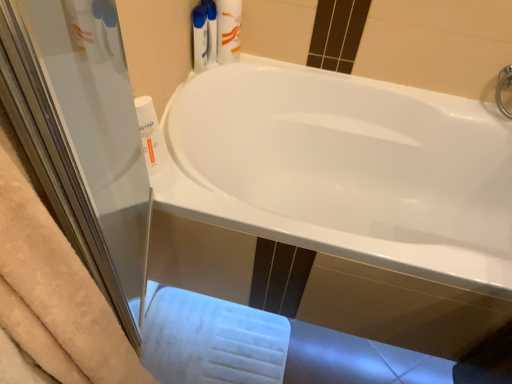
Measure the distance between white plastic bottle at left, the 2th cleaning product positioned from the right, and camera.

They are 36.10 inches apart.

Measure the distance between point (233, 0) and camera.

Point (233, 0) is 1.26 meters away from camera.

Describe the element at coordinates (228, 30) in the screenshot. This screenshot has height=384, width=512. I see `white plastic tube at upper center` at that location.

Identify the location of white glossy bathtub at center. The width and height of the screenshot is (512, 384). (344, 169).

Find the location of `white plastic bottle at upper center, which is counted as the second cleaning product, starting from the bottom`. white plastic bottle at upper center, which is counted as the second cleaning product, starting from the bottom is located at coordinates (204, 35).

Is white glossy bathtub at center not close to white plastic bottle at upper center, the 2th cleaning product positioned from the front?

white glossy bathtub at center is near white plastic bottle at upper center, the 2th cleaning product positioned from the front, not far away.

Is white glossy bathtub at center bigger than white plastic bottle at upper center, the second cleaning product positioned from the left?

Yes, white glossy bathtub at center is bigger than white plastic bottle at upper center, the second cleaning product positioned from the left.

From the picture: Can you confirm if white glossy bathtub at center is positioned to the left of white plastic bottle at upper center, the 1th cleaning product viewed from the top?

Incorrect, white glossy bathtub at center is not on the left side of white plastic bottle at upper center, the 1th cleaning product viewed from the top.

Consider the image. Is white glossy bathtub at center taller or shorter than white plastic bottle at upper center, the 1th cleaning product viewed from the top?

In the image, white glossy bathtub at center appears to be taller than white plastic bottle at upper center, the 1th cleaning product viewed from the top.

From the image's perspective, is white glossy bathtub at center located above white plastic tube at upper center?

No, from the image's perspective, white glossy bathtub at center is not on top of white plastic tube at upper center.

Is white glossy bathtub at center facing towards white plastic tube at upper center?

No, white glossy bathtub at center is not facing towards white plastic tube at upper center.

Considering the positions of objects white glossy bathtub at center and white plastic tube at upper center in the image provided, who is more to the left, white glossy bathtub at center or white plastic tube at upper center?

white plastic tube at upper center is more to the left.

From a real-world perspective, is white glossy bathtub at center over white plastic tube at upper center?

Actually, white glossy bathtub at center is physically below white plastic tube at upper center in the real world.

Considering the positions of objects white plastic tube at upper center and white plastic bottle at left, which is the first cleaning product from left to right, in the image provided, who is more to the left, white plastic tube at upper center or white plastic bottle at left, which is the first cleaning product from left to right,?

From the viewer's perspective, white plastic bottle at left, which is the first cleaning product from left to right, appears more on the left side.

From the image's perspective, is white plastic tube at upper center below white plastic bottle at left, which is the first cleaning product from left to right?

No, from the image's perspective, white plastic tube at upper center is not below white plastic bottle at left, which is the first cleaning product from left to right.

Considering the relative sizes of white plastic tube at upper center and white plastic bottle at left, which is counted as the second cleaning product, starting from the top, in the image provided, is white plastic tube at upper center thinner than white plastic bottle at left, which is counted as the second cleaning product, starting from the top,?

In fact, white plastic tube at upper center might be wider than white plastic bottle at left, which is counted as the second cleaning product, starting from the top.

Is white plastic tube at upper center turned away from white plastic bottle at upper center, which is counted as the first cleaning product, starting from the back?

Yes, white plastic tube at upper center is facing away from white plastic bottle at upper center, which is counted as the first cleaning product, starting from the back.

How far apart are white plastic tube at upper center and white plastic bottle at upper center, the 1th cleaning product viewed from the top?

white plastic tube at upper center and white plastic bottle at upper center, the 1th cleaning product viewed from the top, are 1.67 inches apart from each other.

Is white plastic tube at upper center smaller than white plastic bottle at upper center, which is counted as the first cleaning product, starting from the back?

No, white plastic tube at upper center is not smaller than white plastic bottle at upper center, which is counted as the first cleaning product, starting from the back.

This screenshot has height=384, width=512. What are the coordinates of `toiletry on the right of white plastic bottle at upper center, which is counted as the first cleaning product, starting from the back` in the screenshot? It's located at (228, 30).

From a real-world perspective, does white plastic bottle at left, which is the first cleaning product from left to right, sit lower than white glossy bathtub at center?

Incorrect, from a real-world perspective, white plastic bottle at left, which is the first cleaning product from left to right, is higher than white glossy bathtub at center.

The width and height of the screenshot is (512, 384). What are the coordinates of `the 1st cleaning product behind the white glossy bathtub at center` in the screenshot? It's located at (149, 134).

Who is taller, white plastic bottle at left, positioned as the first cleaning product in front-to-back order, or white glossy bathtub at center?

Standing taller between the two is white glossy bathtub at center.

From the image's perspective, which one is positioned lower, white plastic bottle at upper center, which is counted as the second cleaning product, starting from the bottom, or white plastic tube at upper center?

From the image's view, white plastic bottle at upper center, which is counted as the second cleaning product, starting from the bottom, is below.

Would you say white plastic bottle at upper center, the 1th cleaning product viewed from the top, contains white plastic tube at upper center?

No.

Based on the photo, which is more to the right, white plastic bottle at upper center, the 2th cleaning product positioned from the front, or white plastic tube at upper center?

From the viewer's perspective, white plastic tube at upper center appears more on the right side.

At what (x,y) coordinates should I click in order to perform the action: click on the 1st cleaning product located beneath the white plastic tube at upper center (from a real-world perspective). Please return your answer as a coordinate pair (x, y). Image resolution: width=512 pixels, height=384 pixels. Looking at the image, I should click on (204, 35).

Is white plastic bottle at left, which is the first cleaning product from left to right, aimed at white plastic tube at upper center?

No, white plastic bottle at left, which is the first cleaning product from left to right, is not facing towards white plastic tube at upper center.

Which of these two, white plastic bottle at left, which is counted as the second cleaning product, starting from the top, or white plastic tube at upper center, stands shorter?

white plastic bottle at left, which is counted as the second cleaning product, starting from the top.

In order to click on toiletry behind the white plastic bottle at left, the 2th cleaning product positioned from the right in this screenshot , I will do `click(228, 30)`.

From the image's perspective, which is above, white plastic bottle at left, the first cleaning product from the bottom, or white plastic tube at upper center?

From the image's view, white plastic tube at upper center is above.

Locate an element on the screen. bathtub on the right of white plastic bottle at upper center, the 1th cleaning product viewed from the top is located at coordinates (344, 169).

Locate an element on the screen. The height and width of the screenshot is (384, 512). bathtub that is in front of the white plastic tube at upper center is located at coordinates (344, 169).

Estimate the real-world distances between objects in this image. Which object is further from white plastic bottle at left, the 2th cleaning product when ordered from back to front, white glossy bathtub at center or white plastic tube at upper center?

The object further to white plastic bottle at left, the 2th cleaning product when ordered from back to front, is white glossy bathtub at center.

Based on their spatial positions, is white plastic bottle at left, which is counted as the second cleaning product, starting from the top, or white glossy bathtub at center closer to white plastic tube at upper center?

white plastic bottle at left, which is counted as the second cleaning product, starting from the top.

When comparing their distances from white plastic tube at upper center, does white glossy bathtub at center or white plastic bottle at upper center, which is counted as the first cleaning product, starting from the back, seem further?

Among the two, white glossy bathtub at center is located further to white plastic tube at upper center.

Consider the image. Considering their positions, is white plastic bottle at upper center, the 1th cleaning product viewed from the top, positioned further to white glossy bathtub at center than white plastic tube at upper center?

The object further to white glossy bathtub at center is white plastic bottle at upper center, the 1th cleaning product viewed from the top.

Looking at the image, which one is located closer to white plastic tube at upper center, white plastic bottle at upper center, the 1th cleaning product viewed from the top, or white plastic bottle at left, the 2th cleaning product positioned from the right?

white plastic bottle at upper center, the 1th cleaning product viewed from the top, is closer to white plastic tube at upper center.

Consider the image. When comparing their distances from white plastic bottle at upper center, which is counted as the second cleaning product, starting from the bottom, does white glossy bathtub at center or white plastic tube at upper center seem further?

Based on the image, white glossy bathtub at center appears to be further to white plastic bottle at upper center, which is counted as the second cleaning product, starting from the bottom.

From the picture: Looking at the image, which one is located further to white plastic bottle at left, the first cleaning product from the bottom, white plastic bottle at upper center, the second cleaning product positioned from the left, or white glossy bathtub at center?

white glossy bathtub at center is further to white plastic bottle at left, the first cleaning product from the bottom.

Looking at this image, looking at the image, which one is located closer to white plastic bottle at left, the 2th cleaning product when ordered from back to front, white plastic tube at upper center or white plastic bottle at upper center, the 1th cleaning product viewed from the top?

white plastic bottle at upper center, the 1th cleaning product viewed from the top.

This screenshot has width=512, height=384. I want to click on toiletry between white plastic bottle at left, which is counted as the second cleaning product, starting from the top, and white glossy bathtub at center from left to right, so click(228, 30).

Where is `cleaning product situated between white plastic bottle at left, which is counted as the second cleaning product, starting from the top, and white glossy bathtub at center from left to right`? The image size is (512, 384). cleaning product situated between white plastic bottle at left, which is counted as the second cleaning product, starting from the top, and white glossy bathtub at center from left to right is located at coordinates (204, 35).

Find the location of a particular element. The height and width of the screenshot is (384, 512). cleaning product between white plastic tube at upper center and white plastic bottle at left, the 2th cleaning product when ordered from back to front, in the vertical direction is located at coordinates (204, 35).